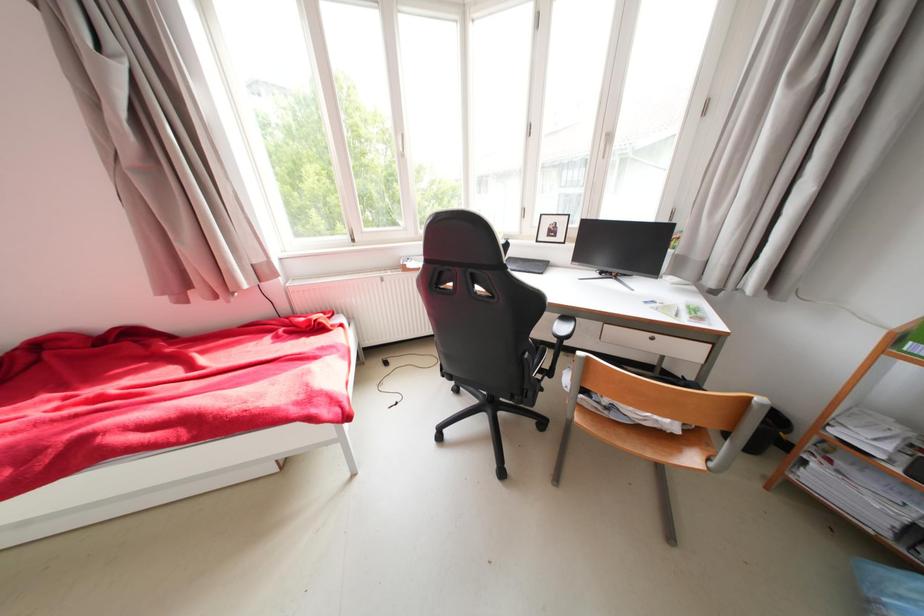
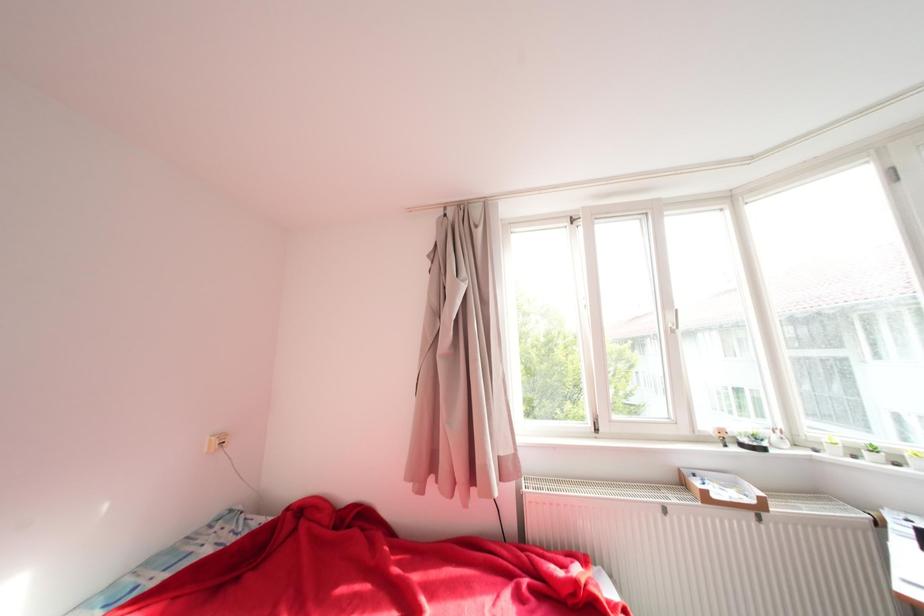
Based on the continuous images, in which direction is the camera rotating?

The camera's rotation is toward left-up.